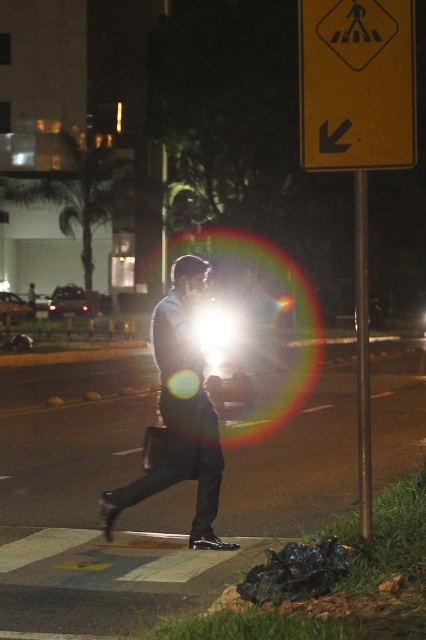
Who is lower down, yellow plastic traffic sign at upper right or metallic pole at right?

yellow plastic traffic sign at upper right

Between point (411, 131) and point (356, 221), which one is positioned in front?

Positioned in front is point (411, 131).

The width and height of the screenshot is (426, 640). Find the location of `yellow plastic traffic sign at upper right`. yellow plastic traffic sign at upper right is located at coordinates (356, 84).

Between light blue shirt at center and metallic pole at right, which one has more height?

metallic pole at right is taller.

Is light blue shirt at center to the left of metallic pole at right from the viewer's perspective?

Yes, light blue shirt at center is to the left of metallic pole at right.

Between point (189, 474) and point (362, 209), which one is positioned in front?

Point (362, 209) is more forward.

Identify the location of light blue shirt at center. The width and height of the screenshot is (426, 640). (180, 413).

Is the position of yellow plastic traffic sign at upper right less distant than that of light blue shirt at center?

Yes, it is.

Does yellow plastic traffic sign at upper right appear on the left side of light blue shirt at center?

Incorrect, yellow plastic traffic sign at upper right is not on the left side of light blue shirt at center.

Is point (322, 116) farther from viewer compared to point (189, 476)?

No, (322, 116) is closer to viewer.

Image resolution: width=426 pixels, height=640 pixels. I want to click on yellow plastic traffic sign at upper right, so click(x=356, y=84).